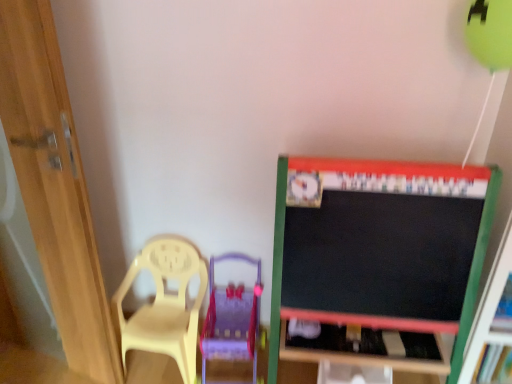
I want to click on yellow plastic chair at left, so click(x=164, y=304).

This screenshot has height=384, width=512. What do you see at coordinates (231, 319) in the screenshot?
I see `translucent yellow swivel chair at lower left` at bounding box center [231, 319].

Measure the distance between wooden door at left and camera.

A distance of 1.12 meters exists between wooden door at left and camera.

Identify the location of yellow plastic chair at left. The height and width of the screenshot is (384, 512). (164, 304).

Is translucent yellow swivel chair at lower left positioned in front of wooden door at left?

No, it is behind wooden door at left.

Which is more to the left, translucent yellow swivel chair at lower left or wooden door at left?

From the viewer's perspective, wooden door at left appears more on the left side.

Is translucent yellow swivel chair at lower left positioned with its back to wooden door at left?

No, translucent yellow swivel chair at lower left is not facing the opposite direction of wooden door at left.

Considering the positions of points (224, 352) and (114, 346), is point (224, 352) farther from camera compared to point (114, 346)?

Yes, point (224, 352) is behind point (114, 346).

From a real-world perspective, is wooden door at left positioned above or below wooden table at lower center?

From a real-world perspective, wooden door at left is physically above wooden table at lower center.

Considering the relative positions of wooden door at left and wooden table at lower center in the image provided, is wooden door at left to the right of wooden table at lower center from the viewer's perspective?

No.

Is wooden door at left not inside wooden table at lower center?

Yes, wooden door at left is outside of wooden table at lower center.

Who is more distant, wooden door at left or wooden table at lower center?

wooden table at lower center is further from the camera.

Is yellow plastic chair at left further to the viewer compared to wooden table at lower center?

That is False.

Can you confirm if yellow plastic chair at left is smaller than wooden table at lower center?

Incorrect, yellow plastic chair at left is not smaller in size than wooden table at lower center.

Considering the relative sizes of yellow plastic chair at left and wooden table at lower center in the image provided, is yellow plastic chair at left taller than wooden table at lower center?

Correct, yellow plastic chair at left is much taller as wooden table at lower center.

How many degrees apart are the facing directions of yellow plastic chair at left and wooden table at lower center?

The angle between the facing direction of yellow plastic chair at left and the facing direction of wooden table at lower center is 1.78 degrees.

Does wooden table at lower center contain translucent yellow swivel chair at lower left?

No, translucent yellow swivel chair at lower left is not inside wooden table at lower center.

Considering the positions of points (381, 334) and (217, 288), is point (381, 334) closer to camera compared to point (217, 288)?

Yes, point (381, 334) is in front of point (217, 288).

Find the location of a particular element. table behind the translucent yellow swivel chair at lower left is located at coordinates (365, 353).

This screenshot has height=384, width=512. In order to click on table behind the wooden door at left in this screenshot , I will do [365, 353].

Considering the sizes of objects wooden table at lower center and wooden door at left in the image provided, who is bigger, wooden table at lower center or wooden door at left?

wooden door at left.

Looking at this image, is wooden table at lower center in front of wooden door at left?

No, the depth of wooden table at lower center is greater than that of wooden door at left.

Which point is more distant from viewer, (x=52, y=83) or (x=186, y=350)?

The point (x=186, y=350) is farther from the camera.

Who is more distant, wooden door at left or yellow plastic chair at left?

Positioned behind is yellow plastic chair at left.

Does wooden door at left have a larger size compared to yellow plastic chair at left?

Correct, wooden door at left is larger in size than yellow plastic chair at left.

I want to click on door above the yellow plastic chair at left (from the image's perspective), so click(x=54, y=196).

Based on the photo, is translucent yellow swivel chair at lower left closer to camera compared to wooden table at lower center?

Yes, translucent yellow swivel chair at lower left is closer to the camera.

How different are the orientations of translucent yellow swivel chair at lower left and wooden table at lower center in degrees?

The angle between the facing direction of translucent yellow swivel chair at lower left and the facing direction of wooden table at lower center is 0.577 degrees.

Does point (248, 305) come behind point (330, 331)?

That is True.

Based on their positions, is translucent yellow swivel chair at lower left located to the left or right of wooden table at lower center?

translucent yellow swivel chair at lower left is to the left of wooden table at lower center.

Locate an element on the screen. swivel chair that appears below the wooden door at left (from a real-world perspective) is located at coordinates (231, 319).

Where is `door in front of the wooden table at lower center`? door in front of the wooden table at lower center is located at coordinates (54, 196).

Which object lies nearer to the anchor point translucent yellow swivel chair at lower left, wooden door at left or wooden table at lower center?

wooden table at lower center is closer to translucent yellow swivel chair at lower left.

Looking at the image, which one is located closer to wooden table at lower center, wooden door at left or yellow plastic chair at left?

Among the two, yellow plastic chair at left is located nearer to wooden table at lower center.

Looking at the image, which one is located further to wooden door at left, yellow plastic chair at left or translucent yellow swivel chair at lower left?

translucent yellow swivel chair at lower left is positioned further to the anchor wooden door at left.

Looking at the image, which one is located closer to wooden table at lower center, translucent yellow swivel chair at lower left or wooden door at left?

translucent yellow swivel chair at lower left is closer to wooden table at lower center.

When comparing their distances from yellow plastic chair at left, does translucent yellow swivel chair at lower left or wooden door at left seem further?

wooden door at left is further to yellow plastic chair at left.

When comparing their distances from wooden door at left, does translucent yellow swivel chair at lower left or yellow plastic chair at left seem further?

translucent yellow swivel chair at lower left lies further to wooden door at left than the other object.

Which object lies further to the anchor point yellow plastic chair at left, wooden table at lower center or wooden door at left?

Among the two, wooden table at lower center is located further to yellow plastic chair at left.

Estimate the real-world distances between objects in this image. Which object is closer to yellow plastic chair at left, wooden table at lower center or translucent yellow swivel chair at lower left?

The object closer to yellow plastic chair at left is translucent yellow swivel chair at lower left.

At what (x,y) coordinates should I click in order to perform the action: click on swivel chair situated between wooden door at left and wooden table at lower center from left to right. Please return your answer as a coordinate pair (x, y). Looking at the image, I should click on (231, 319).

Where is `chair between wooden door at left and translucent yellow swivel chair at lower left in the horizontal direction`? The width and height of the screenshot is (512, 384). chair between wooden door at left and translucent yellow swivel chair at lower left in the horizontal direction is located at coordinates pyautogui.click(x=164, y=304).

Identify the location of chair between wooden door at left and wooden table at lower center. The height and width of the screenshot is (384, 512). (164, 304).

This screenshot has height=384, width=512. Find the location of `swivel chair between yellow plastic chair at left and wooden table at lower center from left to right`. swivel chair between yellow plastic chair at left and wooden table at lower center from left to right is located at coordinates point(231,319).